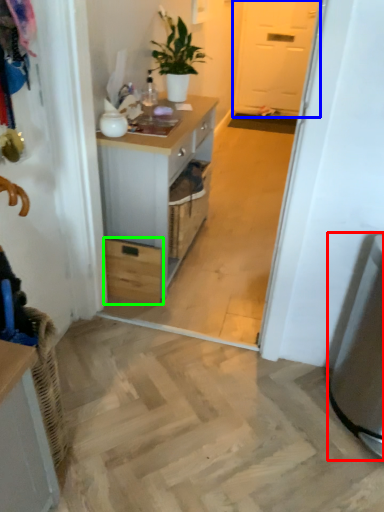
Question: Which object is positioned closest to appliance (highlighted by a red box)? Select from screen door (highlighted by a blue box) and drawer (highlighted by a green box).

Choices:
 (A) screen door
 (B) drawer

Answer: (B)